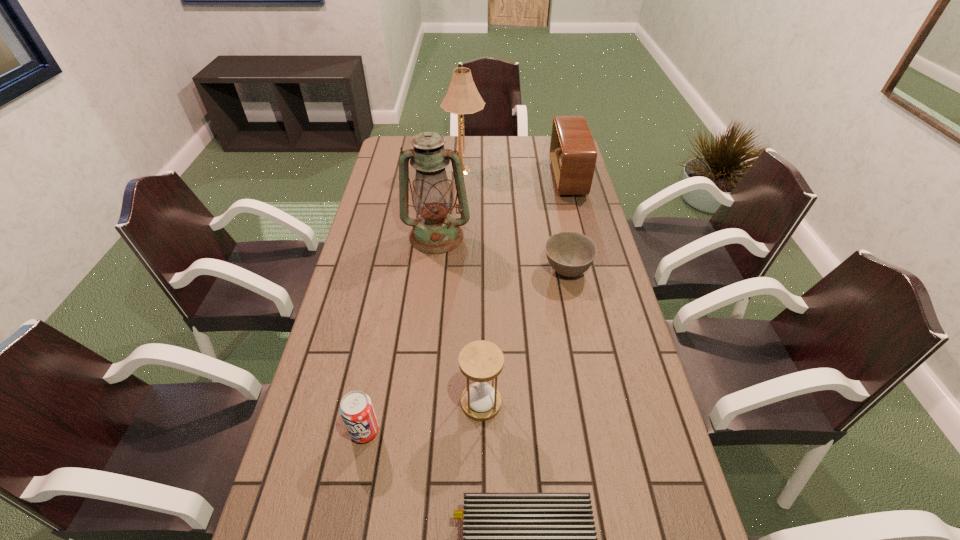
Find the location of a particular element. Image resolution: width=960 pixels, height=540 pixels. free space located 0.090m on the front-facing side of the radio receiver is located at coordinates (530, 178).

The width and height of the screenshot is (960, 540). Find the location of `vacant area situated 0.220m on the front of the hourglass`. vacant area situated 0.220m on the front of the hourglass is located at coordinates (481, 523).

You are a GUI agent. You are given a task and a screenshot of the screen. Output one action in this format:
    pyautogui.click(x=<x>, y=<y>)
    Task: Click on the blank space located on the back of the soda can
    This screenshot has height=540, width=960.
    Given the screenshot: What is the action you would take?
    pyautogui.click(x=378, y=364)

The width and height of the screenshot is (960, 540). Identify the location of free space located 0.400m on the front of the bowl. (594, 406).

Identify the location of lampshade that is at the far edge. (462, 97).

The width and height of the screenshot is (960, 540). What are the coordinates of `radio receiver that is at the far edge` in the screenshot? It's located at (573, 154).

What are the coordinates of `oil lamp that is at the left edge` in the screenshot? It's located at coord(434,232).

The image size is (960, 540). Find the location of `soda can that is at the left edge`. soda can that is at the left edge is located at coordinates (356, 409).

I want to click on radio receiver at the right edge, so click(x=573, y=154).

Locate an element on the screen. This screenshot has height=540, width=960. bowl present at the right edge is located at coordinates (569, 253).